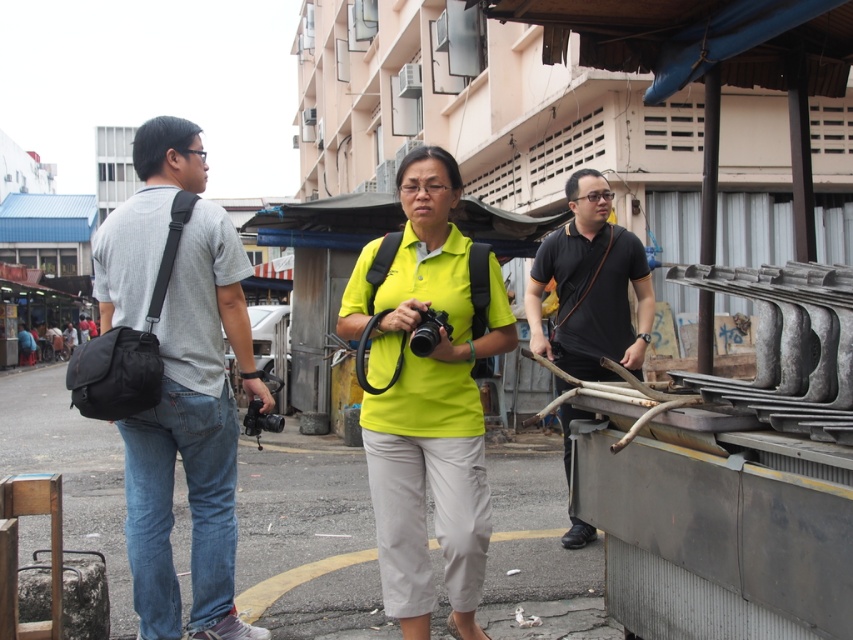
Does neon yellow fabric at center appear on the right side of black plastic video camera at center?

Correct, you'll find neon yellow fabric at center to the right of black plastic video camera at center.

Is point (386, 404) closer to viewer compared to point (256, 429)?

That is True.

This screenshot has height=640, width=853. I want to click on neon yellow fabric at center, so click(x=430, y=406).

Does gray cotton t-shirt at left have a larger size compared to black plastic video camera at center?

Indeed, gray cotton t-shirt at left has a larger size compared to black plastic video camera at center.

Image resolution: width=853 pixels, height=640 pixels. Identify the location of gray cotton t-shirt at left. (192, 436).

Does point (138, 147) come behind point (258, 408)?

No.

Locate an element on the screen. The image size is (853, 640). gray cotton t-shirt at left is located at coordinates (192, 436).

Between gray cotton t-shirt at left and black plastic camera at center, which one has more height?

gray cotton t-shirt at left

Between gray cotton t-shirt at left and black plastic camera at center, which one appears on the left side from the viewer's perspective?

From the viewer's perspective, gray cotton t-shirt at left appears more on the left side.

Locate an element on the screen. gray cotton t-shirt at left is located at coordinates (192, 436).

Locate an element on the screen. This screenshot has width=853, height=640. gray cotton t-shirt at left is located at coordinates (192, 436).